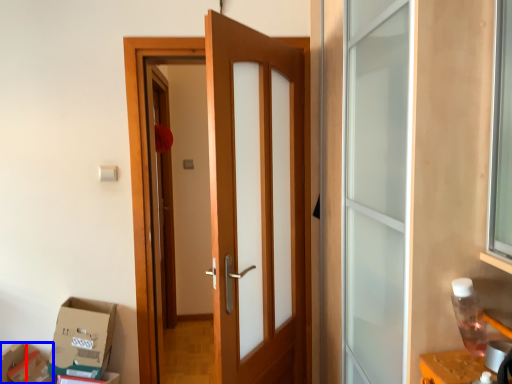
Question: Which object is closer to the camera taking this photo, box (highlighted by a red box) or cardboard box (highlighted by a blue box)?

Choices:
 (A) box
 (B) cardboard box

Answer: (A)